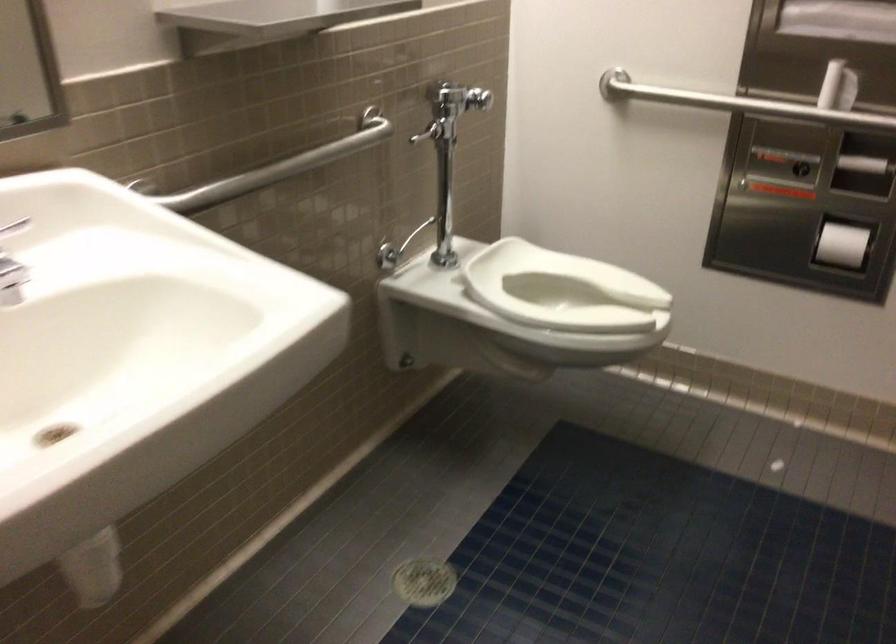
What do you see at coordinates (563, 290) in the screenshot?
I see `the white toilet seat` at bounding box center [563, 290].